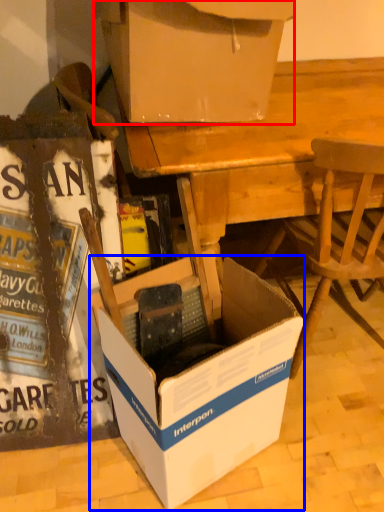
Question: Which object appears farthest to the camera in this image, box (highlighted by a red box) or box (highlighted by a blue box)?

Choices:
 (A) box
 (B) box

Answer: (A)